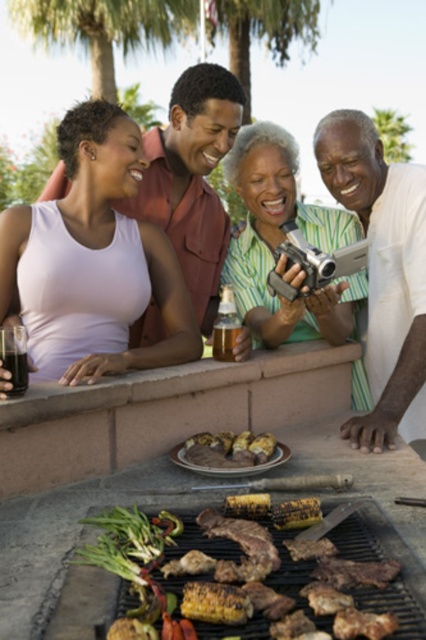
Consider the image. You are a photographer who needs to capture a group photo of the barbecue scene. You have a green matte camera at center and another camera. Which camera should you use to ensure that the subjects are in focus if you want to take a photo from 6 feet away?

The green matte camera at center is 6.05 feet away from the subjects, so using it would allow you to capture the group photo with everyone in focus since the distance matches the camera range.

From the picture: You are standing at the barbecue grill and want to reach both the point at coordinates point (379, 404) and point (227, 460). Which point is closer to you?

Point (227, 460) is closer to you because it is in front of point (379, 404).

You are a photographer taking a picture of the barbecue scene. You notice the white cotton shirt at upper right and the grilled meat at center. Which object should you focus on first if you want to capture both in the frame without moving the camera?

You should focus on the grilled meat at center first because the white cotton shirt at upper right is taller than it, so adjusting focus to the closer object ensures both are in the frame.